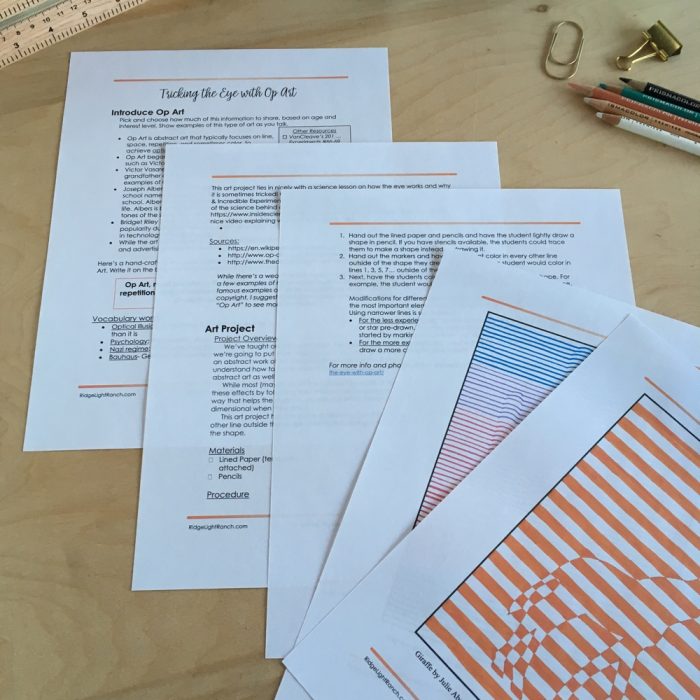
Find the location of a particular element. The image size is (700, 700). picture is located at coordinates (584, 561), (491, 374).